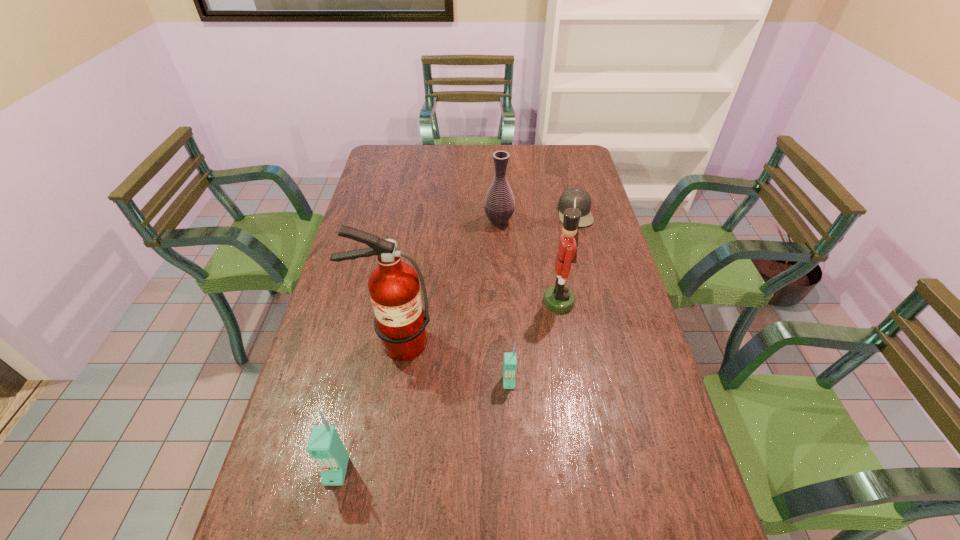
This screenshot has width=960, height=540. I want to click on free spot that satisfies the following two spatial constraints: 1. on the front-facing side of the fifth object from left to right; 2. on the keypad of the nearest object, so click(588, 471).

Where is `vacant space that satisfies the following two spatial constraints: 1. on the brim of the cap; 2. on the nozzle and handle of the fourth farthest object`? The height and width of the screenshot is (540, 960). vacant space that satisfies the following two spatial constraints: 1. on the brim of the cap; 2. on the nozzle and handle of the fourth farthest object is located at coordinates (608, 343).